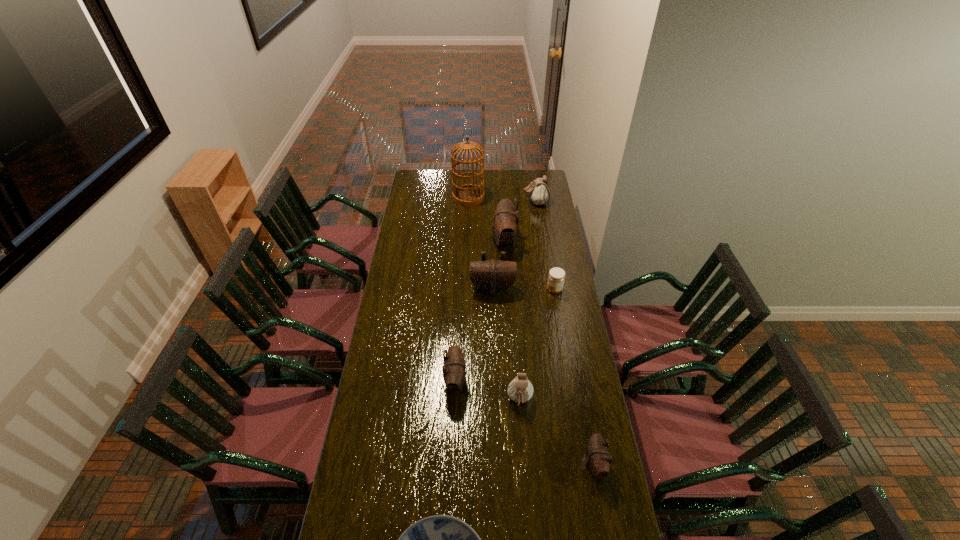
Locate an element on the screen. This screenshot has height=540, width=960. the nearer white pouch is located at coordinates (520, 389).

Locate an element on the screen. The height and width of the screenshot is (540, 960). the rightmost brown pouch is located at coordinates (599, 460).

Identify the location of the nearest pouch. The width and height of the screenshot is (960, 540). (599, 460).

The height and width of the screenshot is (540, 960). Identify the location of orange jam. (556, 277).

Where is `free space located 0.330m on the front of the birdcage`? The height and width of the screenshot is (540, 960). free space located 0.330m on the front of the birdcage is located at coordinates (468, 241).

Find the location of a particular element. vacant space located with the flap open on the third farthest object is located at coordinates (444, 241).

At what (x,y) coordinates should I click in order to perform the action: click on vacant region located 0.050m with the flap open on the third farthest object. Please return your answer as a coordinate pair (x, y). The width and height of the screenshot is (960, 540). Looking at the image, I should click on (483, 241).

The height and width of the screenshot is (540, 960). I want to click on free location located with the flap open on the third farthest object, so click(x=436, y=241).

Where is `vacant point located 0.250m with the flap open on the third smallest brown pouch`? The image size is (960, 540). vacant point located 0.250m with the flap open on the third smallest brown pouch is located at coordinates (494, 338).

Find the location of `free region located on the front-facing side of the right white pouch`. free region located on the front-facing side of the right white pouch is located at coordinates (458, 202).